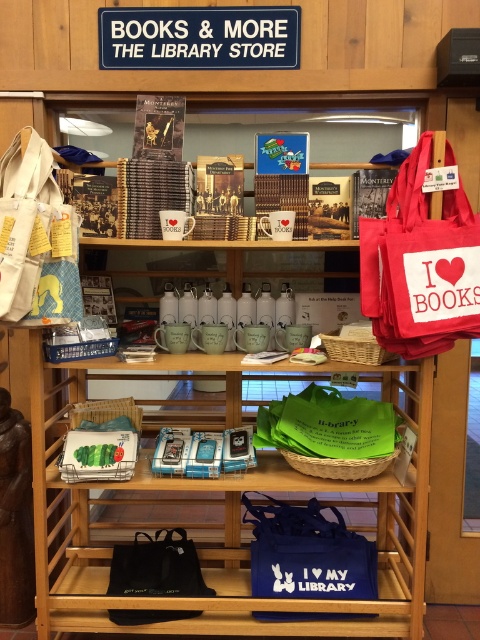
You are standing in front of the store display at Books and More. You see two points marked on the display. The first point is at coordinate point (x=304, y=449) and the second is at coordinate point (x=159, y=547). Which point is closer to you?

Point (x=304, y=449) is in front of point (x=159, y=547), so it is closer to you.

You are a customer in the store and want to choose between the red canvas tote at upper right and the white canvas tote at left. Which one has a larger width?

The red canvas tote at upper right might be wider than the white canvas tote at left.